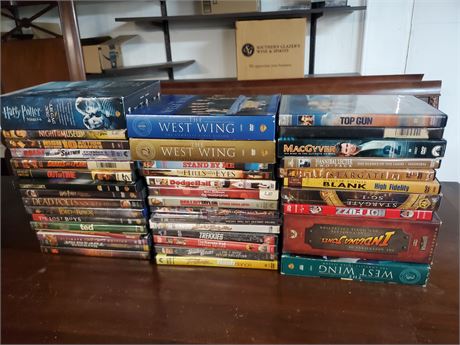
The image size is (460, 345). I want to click on dvds in the third stack, so click(361, 270), click(367, 252), click(409, 214), click(427, 202), click(429, 189), click(427, 175), click(428, 164), click(433, 152), click(435, 136), click(440, 122).